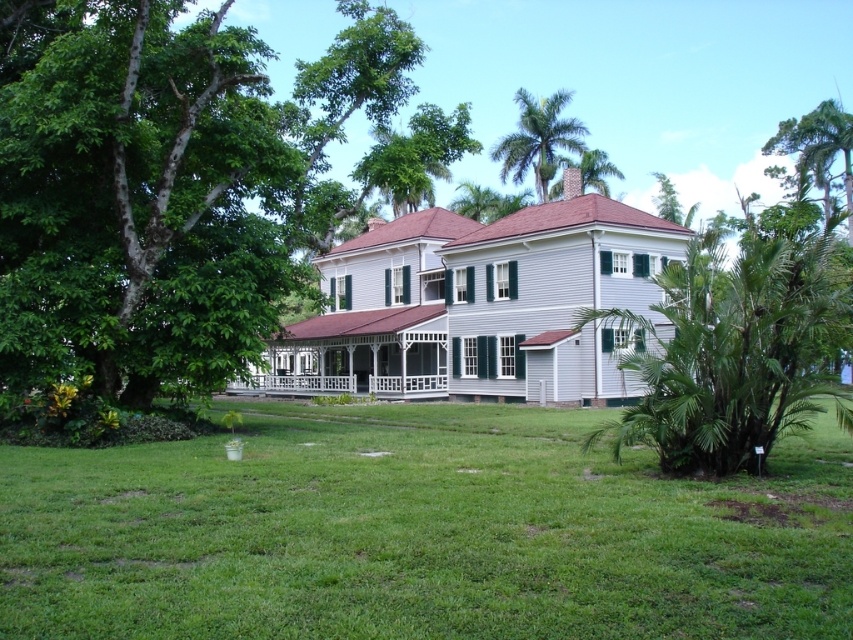
Is the position of green grass at center less distant than that of green leafy palm tree at upper center?

That is True.

Does point (537, 604) lie in front of point (503, 212)?

Yes, it is in front of point (503, 212).

What are the coordinates of `green grass at center` in the screenshot? It's located at (421, 532).

Who is more forward, (396,545) or (592,168)?

Point (396,545)

Is green grass at center positioned before green leafy palm at upper center?

Yes, green grass at center is closer to the viewer.

This screenshot has height=640, width=853. What do you see at coordinates (421, 532) in the screenshot?
I see `green grass at center` at bounding box center [421, 532].

Where is `green grass at center`? The width and height of the screenshot is (853, 640). green grass at center is located at coordinates (421, 532).

Which is more to the right, green leafy palm tree at right or green leafy tree at upper center?

green leafy palm tree at right

Is green leafy palm tree at right smaller than green leafy tree at upper center?

Correct, green leafy palm tree at right occupies less space than green leafy tree at upper center.

The width and height of the screenshot is (853, 640). What do you see at coordinates (737, 353) in the screenshot?
I see `green leafy palm tree at right` at bounding box center [737, 353].

Where is `green leafy palm tree at right`? green leafy palm tree at right is located at coordinates tap(737, 353).